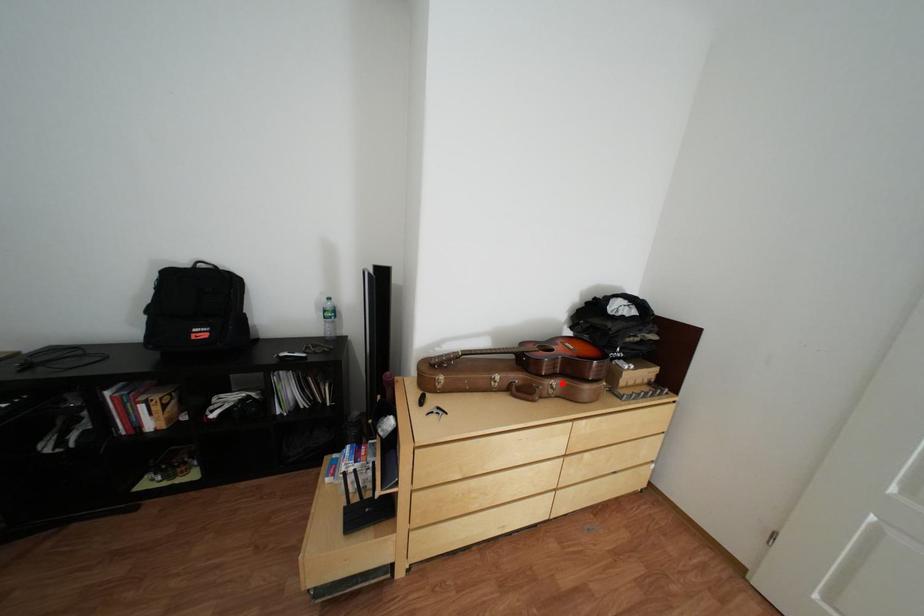
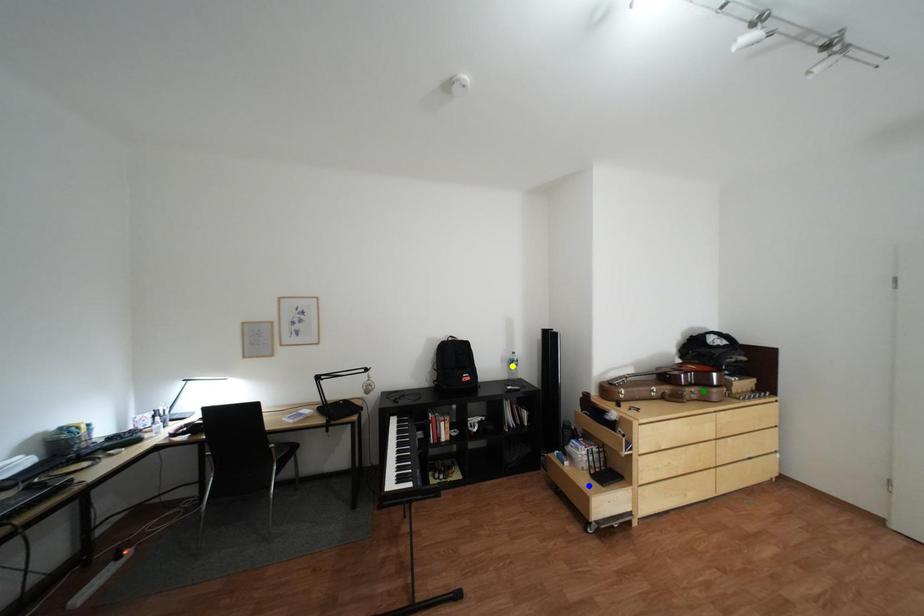
Question: I am providing you with two images of the same scene from different viewpoints. A red point is marked on the first image. You are given multiple points on the second image. Which point in image 2 represents the same 3d spot as the red point in image 1?

Choices:
 (A) yellow point
 (B) green point
 (C) blue point

Answer: (B)